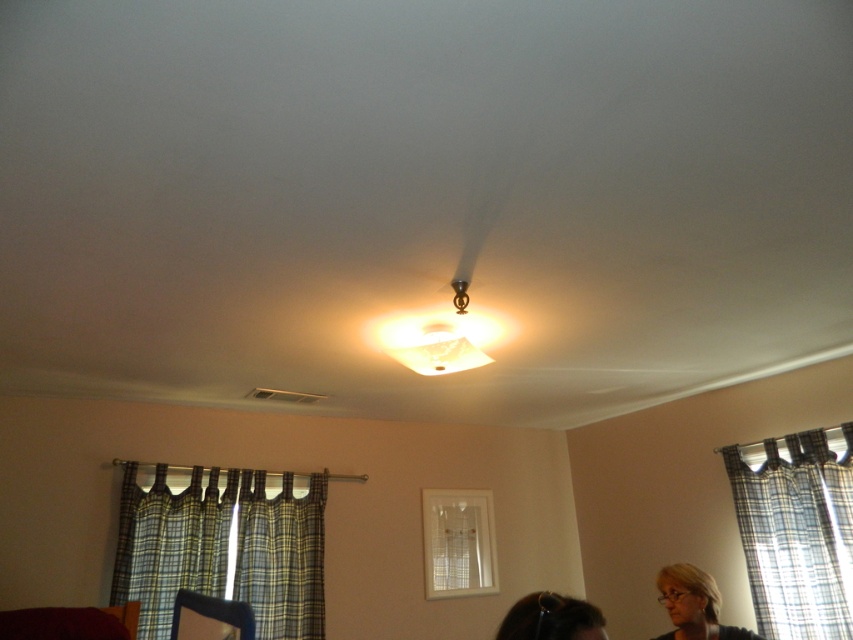
Question: Estimate the real-world distances between objects in this image. Which object is closer to the plaid fabric curtain at lower right?

Choices:
 (A) matte black hair at lower center
 (B) matte black hair at lower right
 (C) plaid fabric curtain at lower left

Answer: (B)

Question: Does plaid fabric curtain at lower left appear under plaid fabric curtain at lower right?

Choices:
 (A) yes
 (B) no

Answer: (A)

Question: Which point is farther from the camera taking this photo?

Choices:
 (A) click(x=599, y=616)
 (B) click(x=811, y=532)
 (C) click(x=694, y=582)

Answer: (B)

Question: Which is farther from the plaid fabric curtain at lower right?

Choices:
 (A) plaid fabric curtain at lower left
 (B) matte black hair at lower right

Answer: (A)

Question: Is plaid fabric curtain at lower right further to camera compared to matte black hair at lower center?

Choices:
 (A) no
 (B) yes

Answer: (B)

Question: Can you confirm if plaid fabric curtain at lower right is positioned below matte black hair at lower right?

Choices:
 (A) yes
 (B) no

Answer: (B)